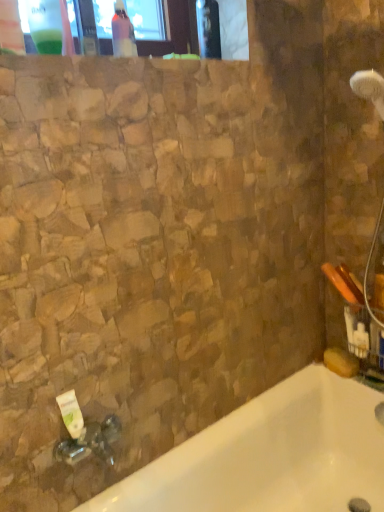
Describe the element at coordinates (71, 414) in the screenshot. I see `white matte tube at lower left` at that location.

What do you see at coordinates (123, 33) in the screenshot? The image size is (384, 512). I see `pink glossy bottle at upper center, the first bottle in the right-to-left sequence` at bounding box center [123, 33].

What do you see at coordinates (270, 455) in the screenshot? This screenshot has height=512, width=384. I see `white glossy bathtub at lower left` at bounding box center [270, 455].

The image size is (384, 512). Identify the location of white matte tube at lower left. (71, 414).

Would you consider transparent plastic bottle at upper left, arranged as the 2th bottle when viewed from the right, to be distant from pink glossy bottle at upper center, the first bottle in the right-to-left sequence?

No, transparent plastic bottle at upper left, arranged as the 2th bottle when viewed from the right, is in close proximity to pink glossy bottle at upper center, the first bottle in the right-to-left sequence.

How distant is transparent plastic bottle at upper left, the 2th bottle viewed from the back, from pink glossy bottle at upper center, which is the 2th bottle from front to back?

7.56 inches.

Can we say transparent plastic bottle at upper left, arranged as the 2th bottle when viewed from the right, lies outside pink glossy bottle at upper center, which is the 2th bottle from front to back?

Yes, transparent plastic bottle at upper left, arranged as the 2th bottle when viewed from the right, is located beyond the bounds of pink glossy bottle at upper center, which is the 2th bottle from front to back.

Is transparent plastic bottle at upper left, the first bottle positioned from the front, to the right of pink glossy bottle at upper center, which is the first bottle from back to front, from the viewer's perspective?

No.

Is the surface of white glossy bathtub at lower left in direct contact with pink glossy bottle at upper center, which is the 2th bottle from front to back?

white glossy bathtub at lower left and pink glossy bottle at upper center, which is the 2th bottle from front to back, are clearly separated.

Which is correct: white glossy bathtub at lower left is inside pink glossy bottle at upper center, the second bottle positioned from the left, or outside of it?

white glossy bathtub at lower left exists outside the volume of pink glossy bottle at upper center, the second bottle positioned from the left.

Where is `bathtub located underneath the pink glossy bottle at upper center, the second bottle positioned from the left (from a real-world perspective)`? bathtub located underneath the pink glossy bottle at upper center, the second bottle positioned from the left (from a real-world perspective) is located at coordinates (270, 455).

In the scene shown: Between white glossy bathtub at lower left and pink glossy bottle at upper center, which is the 2th bottle from front to back, which one is positioned in front?

white glossy bathtub at lower left is closer to the camera.

From the image's perspective, is transparent plastic bottle at upper left, arranged as the 2th bottle when viewed from the right, under white glossy bathtub at lower left?

No, from the image's perspective, transparent plastic bottle at upper left, arranged as the 2th bottle when viewed from the right, is not below white glossy bathtub at lower left.

Is transparent plastic bottle at upper left, which is the first bottle in left-to-right order, at the left side of white glossy bathtub at lower left?

Yes.

Considering their positions, is transparent plastic bottle at upper left, arranged as the 2th bottle when viewed from the right, located in front of or behind white glossy bathtub at lower left?

transparent plastic bottle at upper left, arranged as the 2th bottle when viewed from the right, is positioned farther from the viewer than white glossy bathtub at lower left.

From the image's perspective, between white glossy bathtub at lower left and white matte tube at lower left, who is located below?

white glossy bathtub at lower left is shown below in the image.

Is white glossy bathtub at lower left far away from white matte tube at lower left?

No, white glossy bathtub at lower left is not far from white matte tube at lower left.

From their relative heights in the image, would you say white glossy bathtub at lower left is taller or shorter than white matte tube at lower left?

white glossy bathtub at lower left is taller than white matte tube at lower left.

You are a GUI agent. You are given a task and a screenshot of the screen. Output one action in this format:
    pyautogui.click(x=<x>, y=<y>)
    Task: Click on the toiletry that is above the white glossy bathtub at lower left (from a real-world perspective)
    This screenshot has height=512, width=384.
    Given the screenshot: What is the action you would take?
    pyautogui.click(x=71, y=414)

From a real-world perspective, between pink glossy bottle at upper center, which is the 2th bottle from front to back, and transparent plastic bottle at upper left, the 2th bottle viewed from the back, who is vertically lower?

pink glossy bottle at upper center, which is the 2th bottle from front to back.

Locate an element on the screen. This screenshot has width=384, height=512. bottle on the right side of transparent plastic bottle at upper left, which is the first bottle in left-to-right order is located at coordinates click(123, 33).

In terms of width, does pink glossy bottle at upper center, which is the 2th bottle from front to back, look wider or thinner when compared to transparent plastic bottle at upper left, the 2th bottle viewed from the back?

pink glossy bottle at upper center, which is the 2th bottle from front to back, is thinner than transparent plastic bottle at upper left, the 2th bottle viewed from the back.

From the image's perspective, does pink glossy bottle at upper center, which is the first bottle from back to front, appear lower than transparent plastic bottle at upper left, the 2th bottle viewed from the back?

Incorrect, from the image's perspective, pink glossy bottle at upper center, which is the first bottle from back to front, is higher than transparent plastic bottle at upper left, the 2th bottle viewed from the back.

Visually, is pink glossy bottle at upper center, which is the 2th bottle from front to back, positioned to the left or to the right of white matte tube at lower left?

pink glossy bottle at upper center, which is the 2th bottle from front to back, is to the right of white matte tube at lower left.

Can we say pink glossy bottle at upper center, which is the 2th bottle from front to back, lies outside white matte tube at lower left?

Indeed, pink glossy bottle at upper center, which is the 2th bottle from front to back, is completely outside white matte tube at lower left.

From the picture: Looking at their sizes, would you say pink glossy bottle at upper center, the first bottle in the right-to-left sequence, is wider or thinner than white matte tube at lower left?

Clearly, pink glossy bottle at upper center, the first bottle in the right-to-left sequence, has more width compared to white matte tube at lower left.

Is pink glossy bottle at upper center, the first bottle in the right-to-left sequence, far away from white matte tube at lower left?

pink glossy bottle at upper center, the first bottle in the right-to-left sequence, is far away from white matte tube at lower left.

In terms of width, does transparent plastic bottle at upper left, arranged as the 2th bottle when viewed from the right, look wider or thinner when compared to white matte tube at lower left?

Considering their sizes, transparent plastic bottle at upper left, arranged as the 2th bottle when viewed from the right, looks broader than white matte tube at lower left.

Considering their positions, is transparent plastic bottle at upper left, the 2th bottle viewed from the back, located in front of or behind white matte tube at lower left?

transparent plastic bottle at upper left, the 2th bottle viewed from the back, is in front of white matte tube at lower left.

Is transparent plastic bottle at upper left, arranged as the 2th bottle when viewed from the right, at the right side of white matte tube at lower left?

In fact, transparent plastic bottle at upper left, arranged as the 2th bottle when viewed from the right, is to the left of white matte tube at lower left.

In the image, there is a transparent plastic bottle at upper left, the first bottle positioned from the front. Find the location of `toiletry below it (from the image's perspective)`. toiletry below it (from the image's perspective) is located at coordinates (71, 414).

In the image, there is a pink glossy bottle at upper center, which is the 2th bottle from front to back. At what (x,y) coordinates should I click in order to perform the action: click on bottle below it (from the image's perspective). Please return your answer as a coordinate pair (x, y). Looking at the image, I should click on (45, 25).

Where is `the 1st bottle to the left of the white glossy bathtub at lower left, counting from the anchor's position`? The height and width of the screenshot is (512, 384). the 1st bottle to the left of the white glossy bathtub at lower left, counting from the anchor's position is located at coordinates (123, 33).

When comparing their distances from white glossy bathtub at lower left, does pink glossy bottle at upper center, which is the 2th bottle from front to back, or white matte tube at lower left seem further?

Based on the image, pink glossy bottle at upper center, which is the 2th bottle from front to back, appears to be further to white glossy bathtub at lower left.

When comparing their distances from white glossy bathtub at lower left, does pink glossy bottle at upper center, which is the 2th bottle from front to back, or transparent plastic bottle at upper left, the first bottle positioned from the front, seem closer?

pink glossy bottle at upper center, which is the 2th bottle from front to back, is closer to white glossy bathtub at lower left.

Considering their positions, is transparent plastic bottle at upper left, arranged as the 2th bottle when viewed from the right, positioned further to white glossy bathtub at lower left than white matte tube at lower left?

transparent plastic bottle at upper left, arranged as the 2th bottle when viewed from the right.

Based on their spatial positions, is transparent plastic bottle at upper left, the 2th bottle viewed from the back, or pink glossy bottle at upper center, the second bottle positioned from the left, closer to white glossy bathtub at lower left?

Based on the image, pink glossy bottle at upper center, the second bottle positioned from the left, appears to be nearer to white glossy bathtub at lower left.

Which object lies further to the anchor point white matte tube at lower left, pink glossy bottle at upper center, which is the 2th bottle from front to back, or white glossy bathtub at lower left?

The object further to white matte tube at lower left is pink glossy bottle at upper center, which is the 2th bottle from front to back.

Consider the image. Considering their positions, is transparent plastic bottle at upper left, the first bottle positioned from the front, positioned closer to white matte tube at lower left than pink glossy bottle at upper center, the first bottle in the right-to-left sequence?

The object closer to white matte tube at lower left is transparent plastic bottle at upper left, the first bottle positioned from the front.

From the image, which object appears to be farther from transparent plastic bottle at upper left, arranged as the 2th bottle when viewed from the right, white glossy bathtub at lower left or white matte tube at lower left?

white glossy bathtub at lower left lies further to transparent plastic bottle at upper left, arranged as the 2th bottle when viewed from the right, than the other object.

When comparing their distances from white matte tube at lower left, does pink glossy bottle at upper center, the first bottle in the right-to-left sequence, or transparent plastic bottle at upper left, the first bottle positioned from the front, seem further?

Among the two, pink glossy bottle at upper center, the first bottle in the right-to-left sequence, is located further to white matte tube at lower left.

Locate an element on the screen. This screenshot has width=384, height=512. toiletry between transparent plastic bottle at upper left, the first bottle positioned from the front, and white glossy bathtub at lower left in the up-down direction is located at coordinates (71, 414).

Locate an element on the screen. This screenshot has height=512, width=384. toiletry between pink glossy bottle at upper center, which is the first bottle from back to front, and white glossy bathtub at lower left from top to bottom is located at coordinates (71, 414).

Image resolution: width=384 pixels, height=512 pixels. Find the location of `bottle between pink glossy bottle at upper center, the second bottle positioned from the left, and white matte tube at lower left vertically`. bottle between pink glossy bottle at upper center, the second bottle positioned from the left, and white matte tube at lower left vertically is located at coordinates (45, 25).

Image resolution: width=384 pixels, height=512 pixels. In order to click on bottle between pink glossy bottle at upper center, which is the 2th bottle from front to back, and white glossy bathtub at lower left, in the vertical direction in this screenshot , I will do `click(45, 25)`.